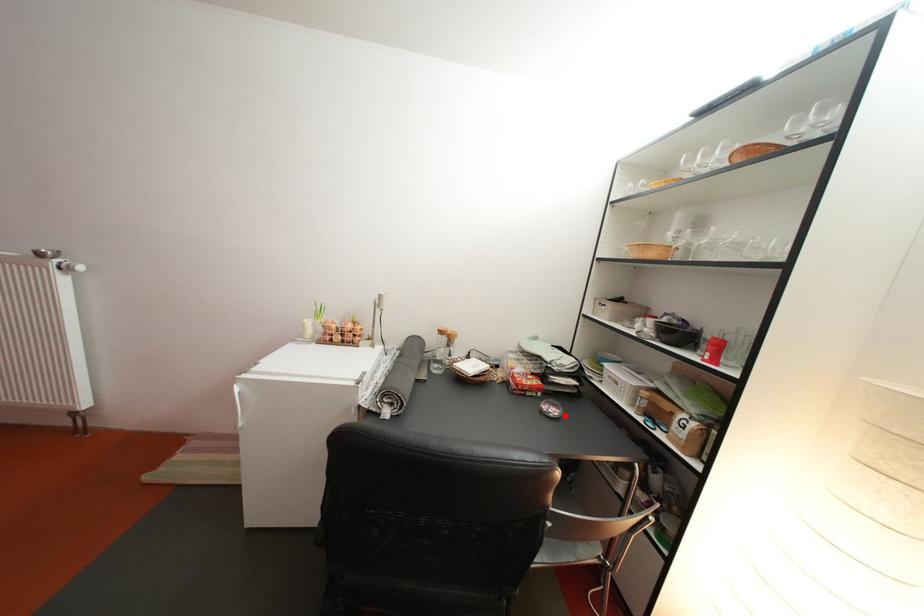
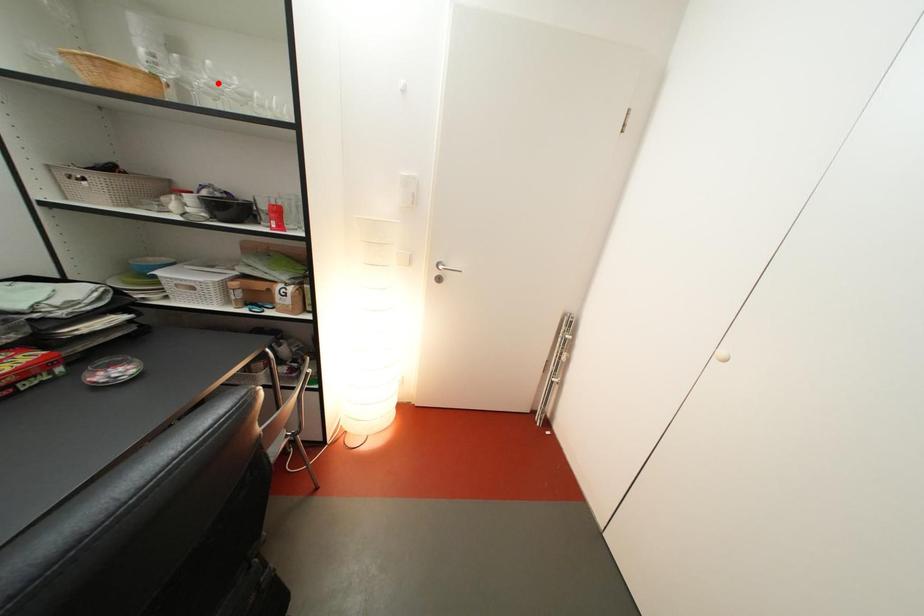
I am providing you with two images of the same scene from different viewpoints. A red point is marked on the first image and another point is marked on the second image. Do the highlighted points in image1 and image2 indicate the same real-world spot?

No